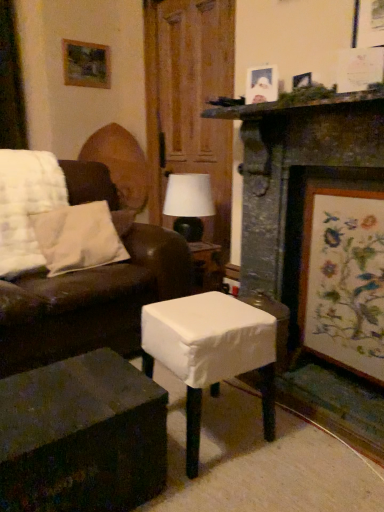
You are a GUI agent. You are given a task and a screenshot of the screen. Output one action in this format:
    pyautogui.click(x=<x>, y=<y>)
    Task: Click on the vacant region in front of white fabric-covered stool at center, positioned as the second table in left-to-right order
    This screenshot has width=384, height=512.
    Given the screenshot: What is the action you would take?
    pyautogui.click(x=231, y=487)